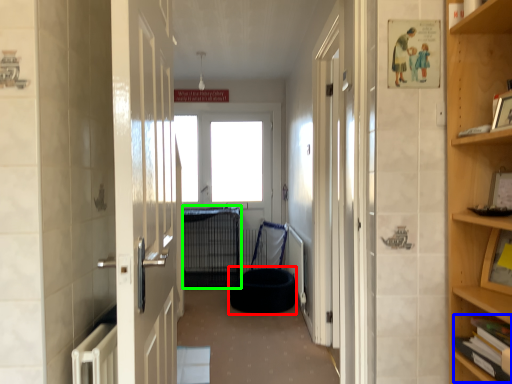
Question: Which object is positioned farthest from dog bed (highlighted by a red box)? Select from book (highlighted by a blue box) and cage (highlighted by a green box).

Choices:
 (A) book
 (B) cage

Answer: (A)